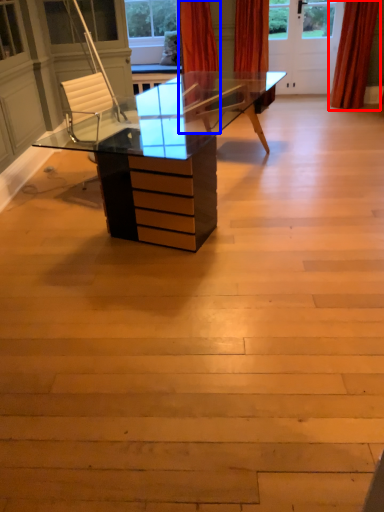
Question: Which object appears closest to the camera in this image, curtain (highlighted by a red box) or curtain (highlighted by a blue box)?

Choices:
 (A) curtain
 (B) curtain

Answer: (B)